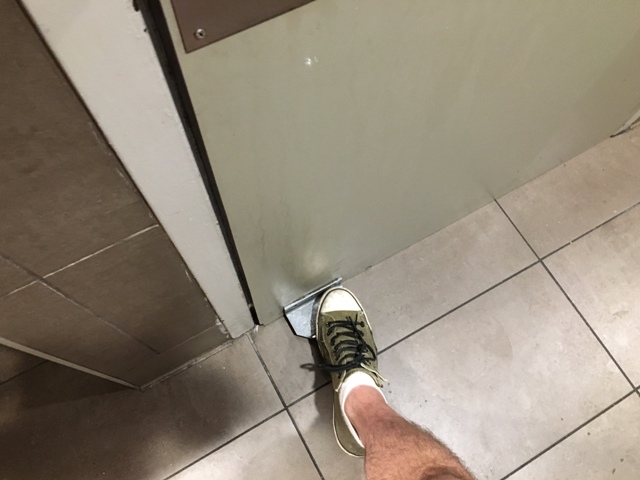
The height and width of the screenshot is (480, 640). Find the location of `door`. door is located at coordinates (260, 92).